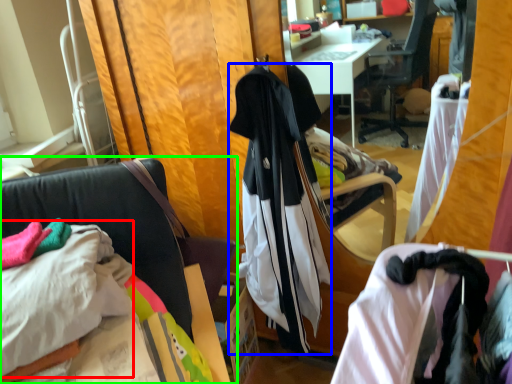
Question: Which object is positioned farthest from sheet (highlighted by a red box)? Select from garment (highlighted by a blue box) and chair (highlighted by a green box).

Choices:
 (A) garment
 (B) chair

Answer: (A)